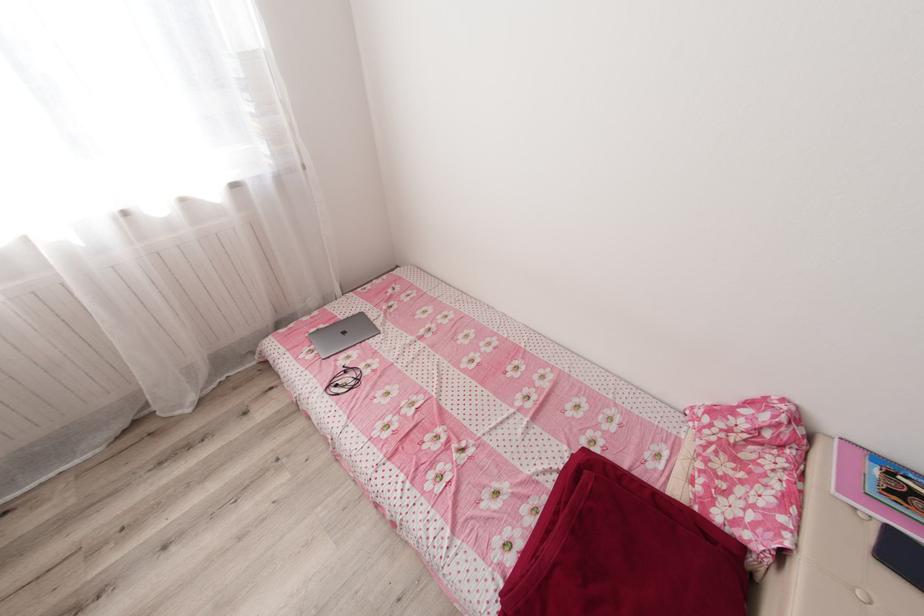
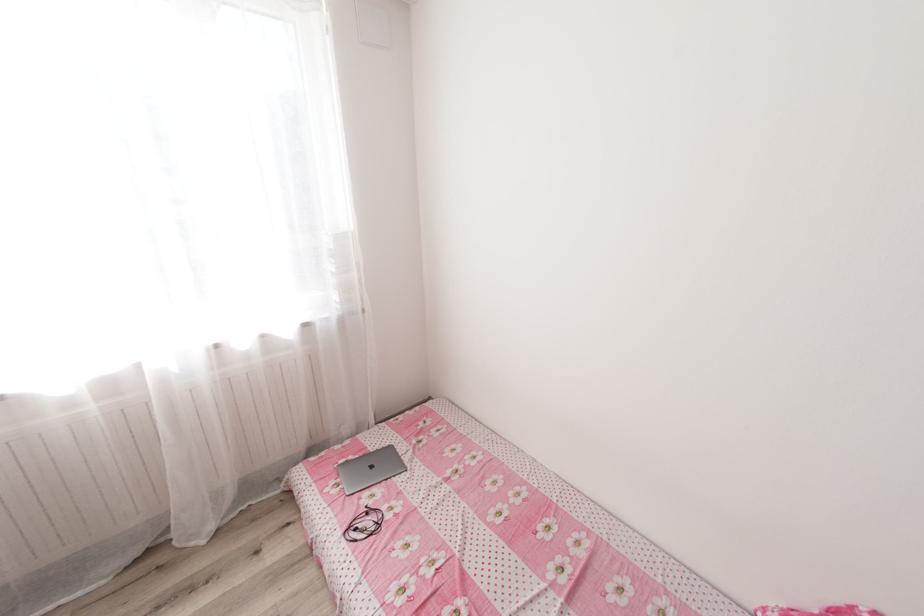
Question: The first image is from the beginning of the video and the second image is from the end. How did the camera likely rotate when shooting the video?

Choices:
 (A) Left
 (B) Right
 (C) Up
 (D) Down

Answer: (C)